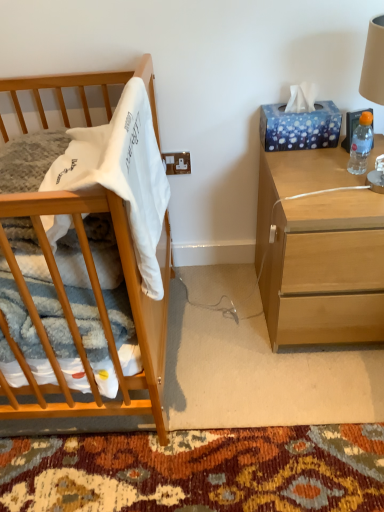
Image resolution: width=384 pixels, height=512 pixels. Identify the location of space that is in front of clear plastic bottle at right. (355, 192).